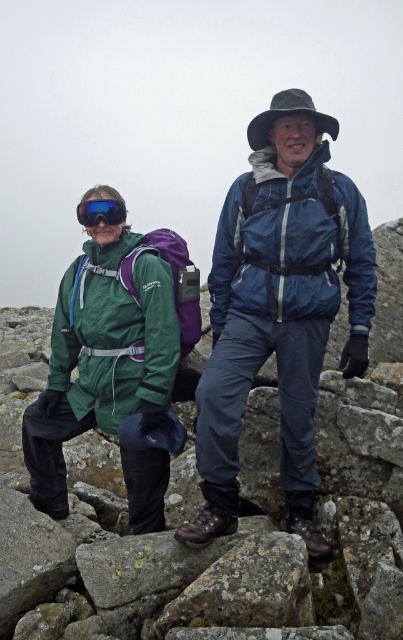
Question: Which of these objects is positioned farthest from the green waterproof jacket at left?

Choices:
 (A) green waterproof jacket at center
 (B) blue reflective goggles at center

Answer: (B)

Question: Estimate the real-world distances between objects in this image. Which object is farther from the blue reflective goggles at center?

Choices:
 (A) green waterproof jacket at center
 (B) green waterproof jacket at left

Answer: (A)

Question: Does green waterproof jacket at center appear on the left side of blue reflective goggles at center?

Choices:
 (A) no
 (B) yes

Answer: (A)

Question: Can you confirm if green waterproof jacket at left is positioned below blue reflective goggles at center?

Choices:
 (A) no
 (B) yes

Answer: (B)

Question: Can you confirm if green waterproof jacket at left is positioned below blue reflective goggles at center?

Choices:
 (A) yes
 (B) no

Answer: (A)

Question: Which of the following is the closest to the observer?

Choices:
 (A) green waterproof jacket at left
 (B) green waterproof jacket at center

Answer: (B)